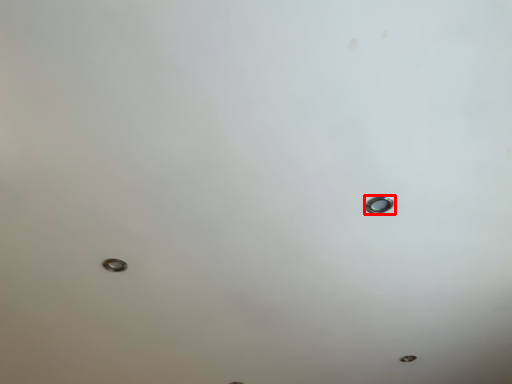
Question: From the image's perspective, what is the correct spatial relationship of nail (annotated by the red box) in relation to bolt?

Choices:
 (A) below
 (B) above

Answer: (B)